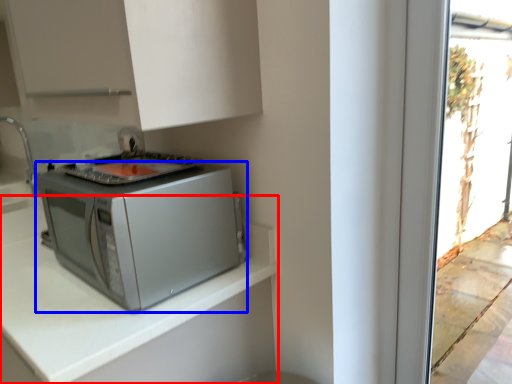
Question: Which point is closer to the camera, countertop (highlighted by a red box) or home appliance (highlighted by a blue box)?

Choices:
 (A) countertop
 (B) home appliance

Answer: (A)